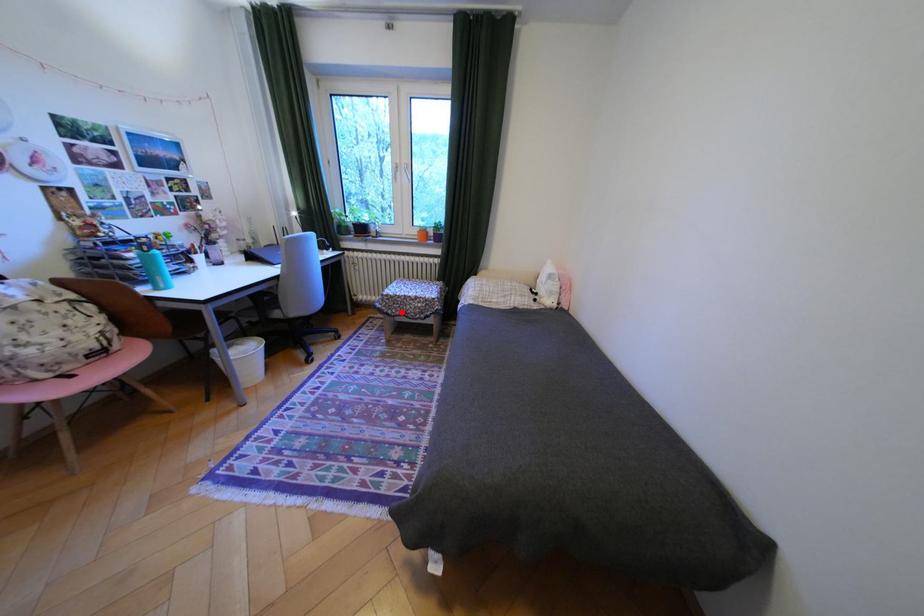
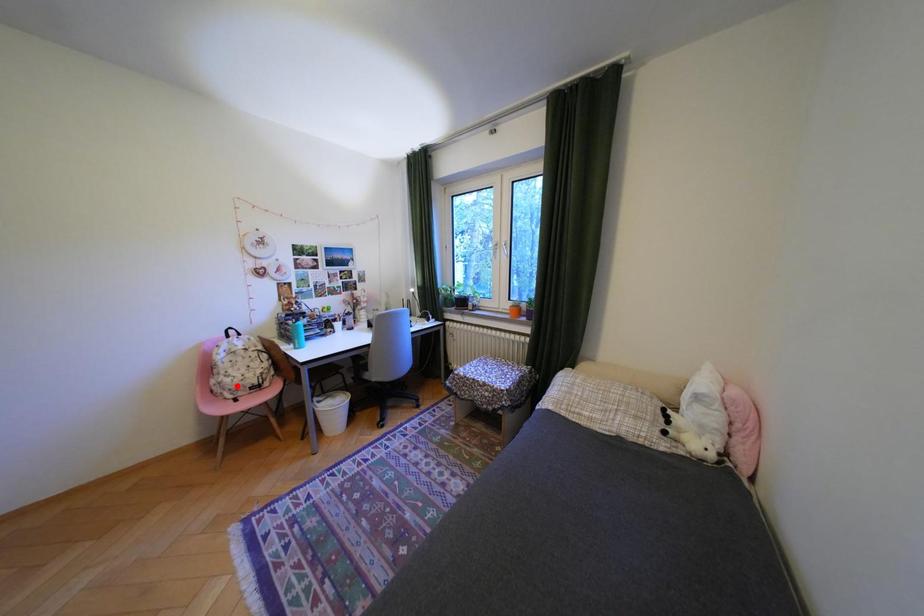
I am providing you with two images of the same scene from different viewpoints. A red point is marked on the first image and another point is marked on the second image. Do the highlighted points in image1 and image2 indicate the same real-world spot?

No